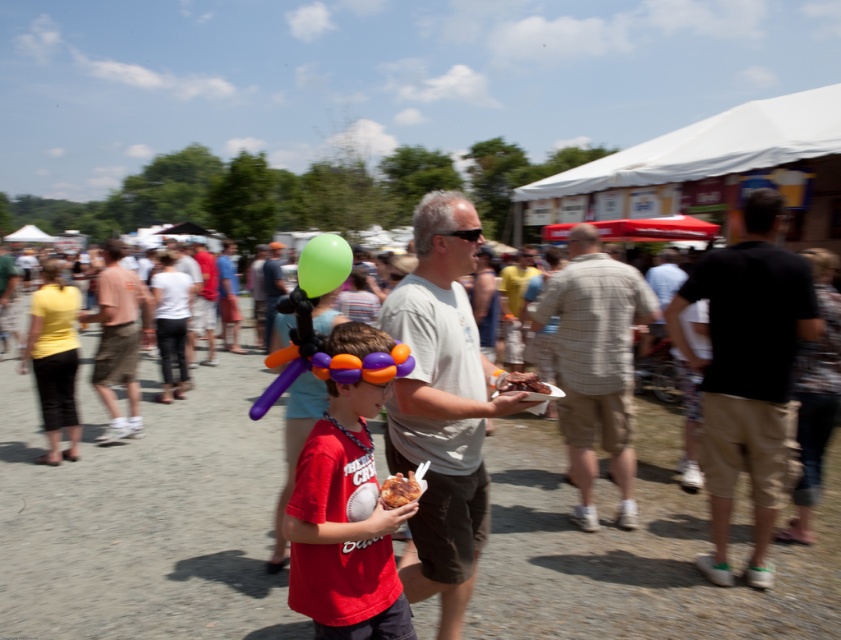
Is matte khaki shorts at left above brown crispy meat at center?

Incorrect, matte khaki shorts at left is not positioned above brown crispy meat at center.

Is point (118, 250) more distant than point (519, 376)?

Yes, point (118, 250) is behind point (519, 376).

Locate an element on the screen. This screenshot has width=841, height=640. matte khaki shorts at left is located at coordinates (118, 339).

Does gray cotton shirt at center have a lesser width compared to green rubber balloon at center?

Yes.

Locate an element on the screen. This screenshot has width=841, height=640. gray cotton shirt at center is located at coordinates (443, 404).

Find the location of a particular element. The width and height of the screenshot is (841, 640). gray cotton shirt at center is located at coordinates (443, 404).

From the picture: Does gray cotton shirt at center have a smaller size compared to black cotton shirt at right?

Yes, gray cotton shirt at center is smaller than black cotton shirt at right.

How distant is gray cotton shirt at center from black cotton shirt at right?

5.19 feet

Is point (479, 492) positioned in front of point (734, 304)?

Yes, it is in front of point (734, 304).

Image resolution: width=841 pixels, height=640 pixels. Identify the location of gray cotton shirt at center. (443, 404).